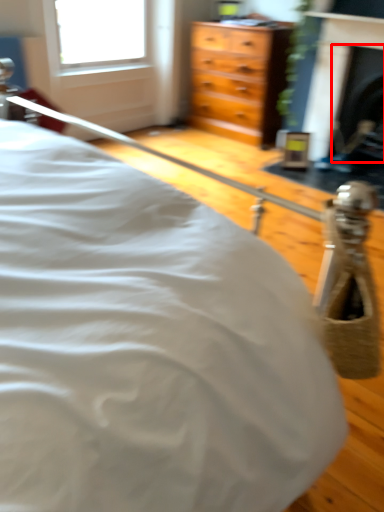
Question: Considering the relative positions of fireplace (annotated by the red box) and fireplace in the image provided, where is fireplace (annotated by the red box) located with respect to the staircase?

Choices:
 (A) right
 (B) left

Answer: (A)